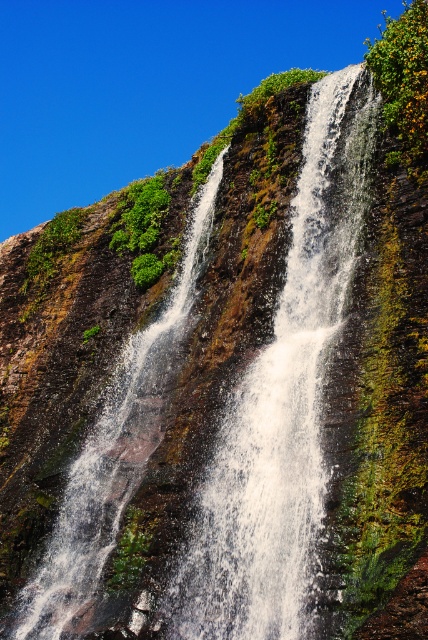
Measure the distance from white frothy water at center to white frothy water at left.

white frothy water at center is 8.93 meters away from white frothy water at left.

Does white frothy water at center lie in front of white frothy water at left?

That is True.

Measure the distance between point (347, 204) and camera.

A distance of 55.98 meters exists between point (347, 204) and camera.

Identify the location of white frothy water at center. (282, 404).